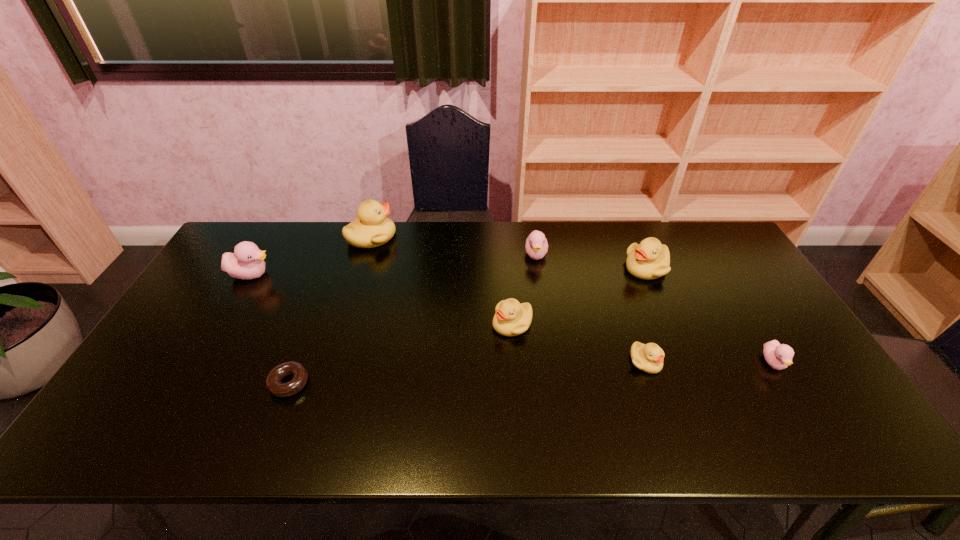
You are a GUI agent. You are given a task and a screenshot of the screen. Output one action in this format:
    pyautogui.click(x=<x>, y=<y>)
    Task: Click on the empty space between the third yellow duckling from right to left and the leftmost yellow duckling
    This screenshot has width=960, height=540.
    Given the screenshot: What is the action you would take?
    pyautogui.click(x=442, y=281)

Where is `vacant region between the second smallest pink duckling and the third smallest yellow duckling`? This screenshot has width=960, height=540. vacant region between the second smallest pink duckling and the third smallest yellow duckling is located at coordinates (591, 261).

Where is `free space between the farthest yellow duckling and the shortest object`? The height and width of the screenshot is (540, 960). free space between the farthest yellow duckling and the shortest object is located at coordinates (330, 310).

What are the coordinates of `the sixth closest object to the rightmost object` in the screenshot? It's located at (273, 381).

Identify which object is the nearest to the nearest yellow duckling. Please provide its 2D coordinates. Your answer should be formatted as a tuple, i.e. [(x, y)], where the tuple contains the x and y coordinates of a point satisfying the conditions above.

[(511, 318)]

Identify which duckling is the fifth closest to the fourth nearest object. Please provide its 2D coordinates. Your answer should be formatted as a tuple, i.e. [(x, y)], where the tuple contains the x and y coordinates of a point satisfying the conditions above.

[(779, 356)]

Identify which duckling is the second closest to the third duckling from left to right. Please provide its 2D coordinates. Your answer should be formatted as a tuple, i.e. [(x, y)], where the tuple contains the x and y coordinates of a point satisfying the conditions above.

[(649, 358)]

The image size is (960, 540). I want to click on yellow duckling identified as the fourth closest to the fourth object from right to left, so click(x=372, y=228).

Locate an element on the screen. This screenshot has width=960, height=540. yellow duckling that is the fourth closest to the doughnut is located at coordinates (649, 259).

Select which pink duckling is the closest to the second biggest yellow duckling. Please provide its 2D coordinates. Your answer should be formatted as a tuple, i.e. [(x, y)], where the tuple contains the x and y coordinates of a point satisfying the conditions above.

[(536, 246)]